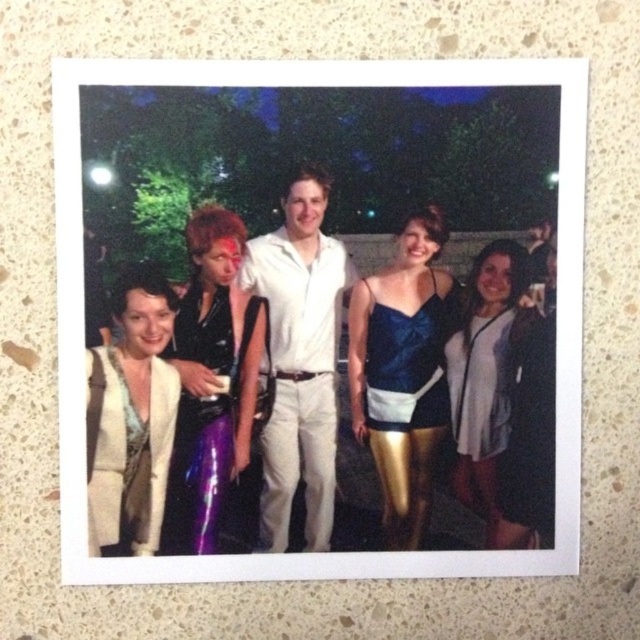
Does white cotton shirt at center come in front of blue satin dress at center?

Yes, white cotton shirt at center is closer to the viewer.

Can you confirm if white cotton shirt at center is positioned to the left of blue satin dress at center?

Indeed, white cotton shirt at center is positioned on the left side of blue satin dress at center.

Identify the location of white cotton shirt at center. This screenshot has width=640, height=640. (298, 356).

Which is behind, point (211, 429) or point (488, 324)?

The point (488, 324) is behind.

Can you confirm if shiny purple dress at center is taller than white matte shirt at center?

Yes, shiny purple dress at center is taller than white matte shirt at center.

Is point (195, 218) positioned after point (515, 250)?

No, it is in front of (515, 250).

I want to click on shiny purple dress at center, so point(211,381).

From the picture: Which of these two, white matte shirt at center or white matte jacket at right, stands taller?

white matte shirt at center

Is white matte shirt at center positioned in front of white matte jacket at right?

Yes, white matte shirt at center is closer to the viewer.

Is point (506, 328) behind point (470, 429)?

That is False.

Locate an element on the screen. This screenshot has width=640, height=640. white matte shirt at center is located at coordinates (484, 374).